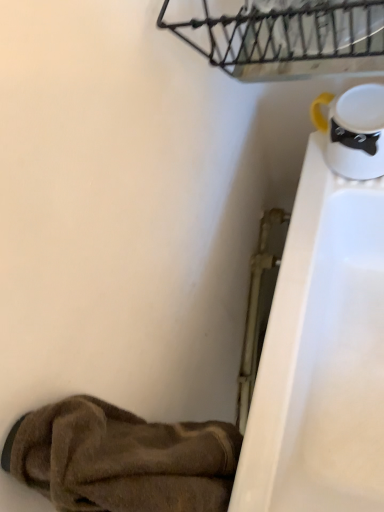
Where is `rustic metal basket at upper center`? The image size is (384, 512). rustic metal basket at upper center is located at coordinates (291, 40).

Image resolution: width=384 pixels, height=512 pixels. Describe the element at coordinates (291, 40) in the screenshot. I see `rustic metal basket at upper center` at that location.

Measure the distance between point (354,14) and camera.

Point (354,14) is 49.50 centimeters from camera.

In order to face brown fuzzy slipper at lower left, should I rotate leftwards or rightwards?

To align with it, rotate left about 2.929°.

Where is `brown fuzzy slipper at lower left`? Image resolution: width=384 pixels, height=512 pixels. brown fuzzy slipper at lower left is located at coordinates (122, 459).

What do you see at coordinates (122, 459) in the screenshot?
I see `brown fuzzy slipper at lower left` at bounding box center [122, 459].

Measure the distance between point (227, 483) and camera.

19.61 inches.

The width and height of the screenshot is (384, 512). In order to click on rustic metal basket at upper center in this screenshot , I will do `click(291, 40)`.

Considering the positions of objects rustic metal basket at upper center and brown fuzzy slipper at lower left in the image provided, who is more to the right, rustic metal basket at upper center or brown fuzzy slipper at lower left?

rustic metal basket at upper center is more to the right.

Based on the photo, which is in front, rustic metal basket at upper center or brown fuzzy slipper at lower left?

Positioned in front is brown fuzzy slipper at lower left.

Between point (296, 73) and point (35, 464), which one is positioned in front?

Point (35, 464)

From the image's perspective, is rustic metal basket at upper center located above or below brown fuzzy slipper at lower left?

Clearly, from the image's perspective, rustic metal basket at upper center is above brown fuzzy slipper at lower left.

From a real-world perspective, is rustic metal basket at upper center under brown fuzzy slipper at lower left?

Actually, rustic metal basket at upper center is physically above brown fuzzy slipper at lower left in the real world.

Is rustic metal basket at upper center wider than brown fuzzy slipper at lower left?

Correct, the width of rustic metal basket at upper center exceeds that of brown fuzzy slipper at lower left.

From the picture: Considering the relative sizes of rustic metal basket at upper center and brown fuzzy slipper at lower left in the image provided, is rustic metal basket at upper center shorter than brown fuzzy slipper at lower left?

Yes.

Can you confirm if rustic metal basket at upper center is smaller than brown fuzzy slipper at lower left?

Yes, rustic metal basket at upper center is smaller than brown fuzzy slipper at lower left.

Is rustic metal basket at upper center completely or partially outside of brown fuzzy slipper at lower left?

Yes, rustic metal basket at upper center is outside of brown fuzzy slipper at lower left.

Consider the image. Are rustic metal basket at upper center and brown fuzzy slipper at lower left located far from each other?

No, rustic metal basket at upper center is not far from brown fuzzy slipper at lower left.

Is rustic metal basket at upper center oriented away from brown fuzzy slipper at lower left?

No, brown fuzzy slipper at lower left is not at the back of rustic metal basket at upper center.

Looking at this image, how different are the orientations of rustic metal basket at upper center and brown fuzzy slipper at lower left in degrees?

The angle between the facing direction of rustic metal basket at upper center and the facing direction of brown fuzzy slipper at lower left is 87 degrees.

How distant is rustic metal basket at upper center from brown fuzzy slipper at lower left?

rustic metal basket at upper center and brown fuzzy slipper at lower left are 47.02 centimeters apart.

Locate an element on the screen. The width and height of the screenshot is (384, 512). basket that appears above the brown fuzzy slipper at lower left (from a real-world perspective) is located at coordinates (291, 40).

Is brown fuzzy slipper at lower left to the left or to the right of rustic metal basket at upper center in the image?

Clearly, brown fuzzy slipper at lower left is on the left of rustic metal basket at upper center in the image.

In the image, is brown fuzzy slipper at lower left positioned in front of or behind rustic metal basket at upper center?

Visually, brown fuzzy slipper at lower left is located in front of rustic metal basket at upper center.

Does point (219, 437) come farther from viewer compared to point (381, 30)?

That is True.

From the image's perspective, is brown fuzzy slipper at lower left located beneath rustic metal basket at upper center?

Yes.

From a real-world perspective, who is located lower, brown fuzzy slipper at lower left or rustic metal basket at upper center?

In real-world perspective, brown fuzzy slipper at lower left is lower.

Which object is wider, brown fuzzy slipper at lower left or rustic metal basket at upper center?

With larger width is rustic metal basket at upper center.

Which of these two, brown fuzzy slipper at lower left or rustic metal basket at upper center, stands shorter?

With less height is rustic metal basket at upper center.

Can you confirm if brown fuzzy slipper at lower left is bigger than rustic metal basket at upper center?

Yes.

In the scene shown: Do you think brown fuzzy slipper at lower left is within rustic metal basket at upper center, or outside of it?

brown fuzzy slipper at lower left is outside rustic metal basket at upper center.

Would you consider brown fuzzy slipper at lower left to be distant from rustic metal basket at upper center?

No, brown fuzzy slipper at lower left is not far from rustic metal basket at upper center.

Is brown fuzzy slipper at lower left oriented away from rustic metal basket at upper center?

brown fuzzy slipper at lower left does not have its back to rustic metal basket at upper center.

How many degrees apart are the facing directions of brown fuzzy slipper at lower left and rustic metal basket at upper center?

The angular difference between brown fuzzy slipper at lower left and rustic metal basket at upper center is 87 degrees.

Measure the distance from brown fuzzy slipper at lower left to rustic metal basket at upper center.

A distance of 18.51 inches exists between brown fuzzy slipper at lower left and rustic metal basket at upper center.

Image resolution: width=384 pixels, height=512 pixels. Identify the location of footwear in front of the rustic metal basket at upper center. [x=122, y=459].

Where is `footwear in front of the rustic metal basket at upper center`? footwear in front of the rustic metal basket at upper center is located at coordinates (122, 459).

You are a GUI agent. You are given a task and a screenshot of the screen. Output one action in this format:
    pyautogui.click(x=<x>, y=<y>)
    Task: Click on the basket that is above the brown fuzzy slipper at lower left (from the image's perspective)
    This screenshot has width=384, height=512.
    Given the screenshot: What is the action you would take?
    pyautogui.click(x=291, y=40)